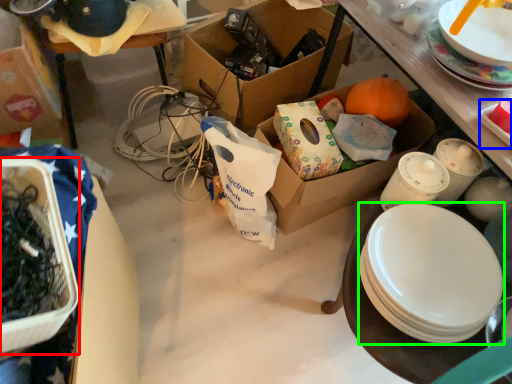
Question: Based on their relative distances, which object is nearer to box (highlighted by a red box)? Choose from platter (highlighted by a blue box) and plate (highlighted by a green box).

Choices:
 (A) platter
 (B) plate

Answer: (B)